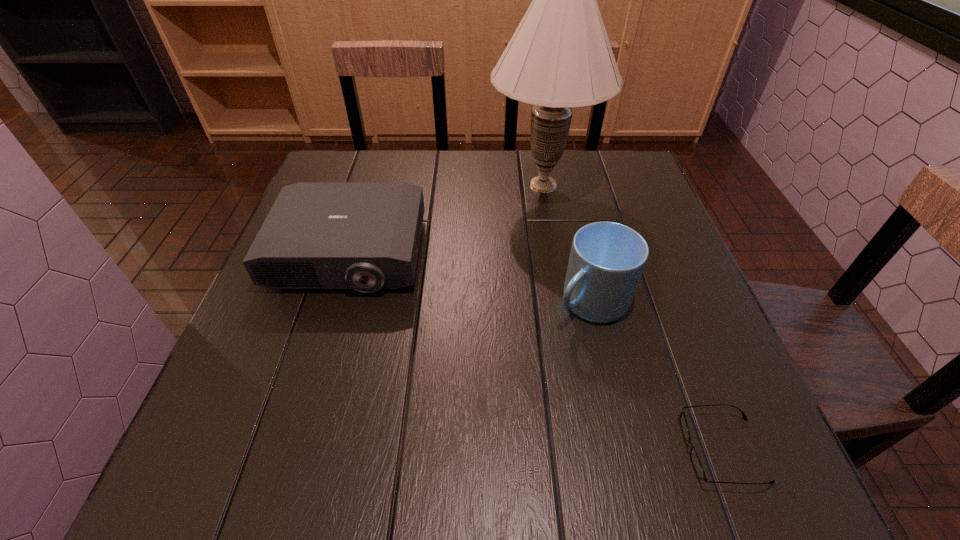
You are a GUI agent. You are given a task and a screenshot of the screen. Output one action in this format:
    pyautogui.click(x=<x>, y=<y>)
    Task: Click on the tallest object
    This screenshot has height=540, width=960.
    Given the screenshot: What is the action you would take?
    pyautogui.click(x=560, y=57)

Where is `mug`? The height and width of the screenshot is (540, 960). mug is located at coordinates (607, 259).

This screenshot has width=960, height=540. Find the location of `the third tallest object`. the third tallest object is located at coordinates (365, 236).

You are a GUI agent. You are given a task and a screenshot of the screen. Output one action in this format:
    pyautogui.click(x=<x>, y=<y>)
    Task: Click on the leftmost object
    The image size is (960, 540).
    Given the screenshot: What is the action you would take?
    pyautogui.click(x=365, y=236)

This screenshot has width=960, height=540. What are the coordinates of `the rightmost object` in the screenshot? It's located at (696, 463).

Where is `the shortest object`? the shortest object is located at coordinates (696, 463).

Where is `vacant space located on the front of the lampshade`? vacant space located on the front of the lampshade is located at coordinates (553, 243).

What are the coordinates of `free space located on the left of the mug` in the screenshot? It's located at (479, 302).

You are a GUI agent. You are given a task and a screenshot of the screen. Output one action in this format:
    pyautogui.click(x=<x>, y=<y>)
    Task: Click on the vacant space situated on the front-facing side of the third tallest object
    The height and width of the screenshot is (540, 960).
    Given the screenshot: What is the action you would take?
    pyautogui.click(x=310, y=384)

This screenshot has width=960, height=540. I want to click on free space located on the front-facing side of the rightmost object, so click(x=620, y=449).